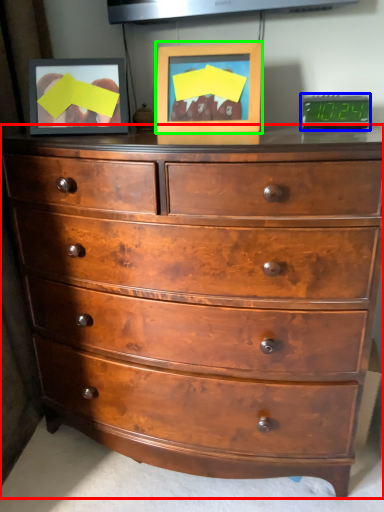
Question: Based on their relative distances, which object is farther from chest of drawers (highlighted by a red box)? Choose from alarm clock (highlighted by a blue box) and picture frame (highlighted by a green box).

Choices:
 (A) alarm clock
 (B) picture frame

Answer: (A)